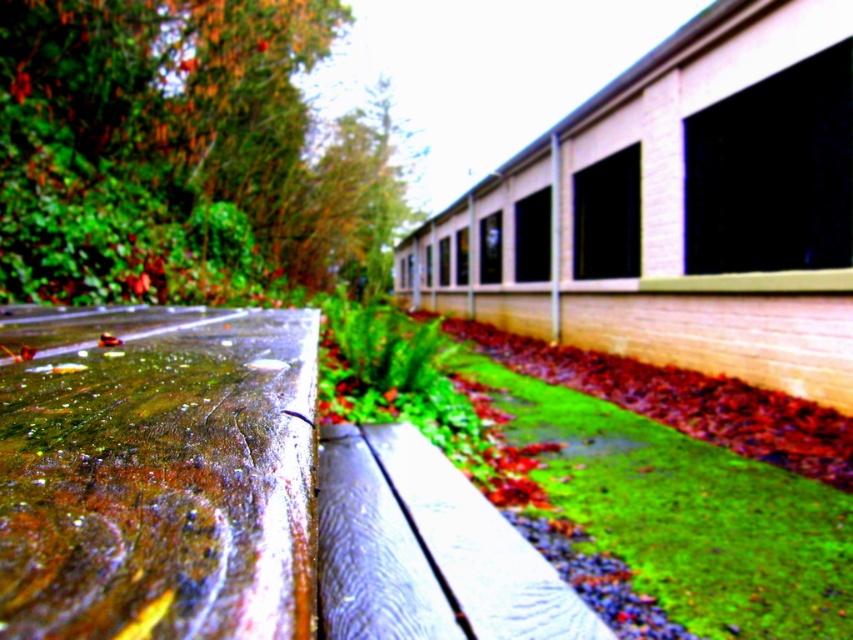
Does wet wood bench at lower left appear over green mossy grass at lower right?

Yes, wet wood bench at lower left is above green mossy grass at lower right.

Looking at this image, can you confirm if wet wood bench at lower left is positioned to the right of green mossy grass at lower right?

Incorrect, wet wood bench at lower left is not on the right side of green mossy grass at lower right.

Who is more forward, [96,467] or [598,461]?

Point [96,467]

Where is `wet wood bench at lower left`? This screenshot has height=640, width=853. wet wood bench at lower left is located at coordinates tap(236, 497).